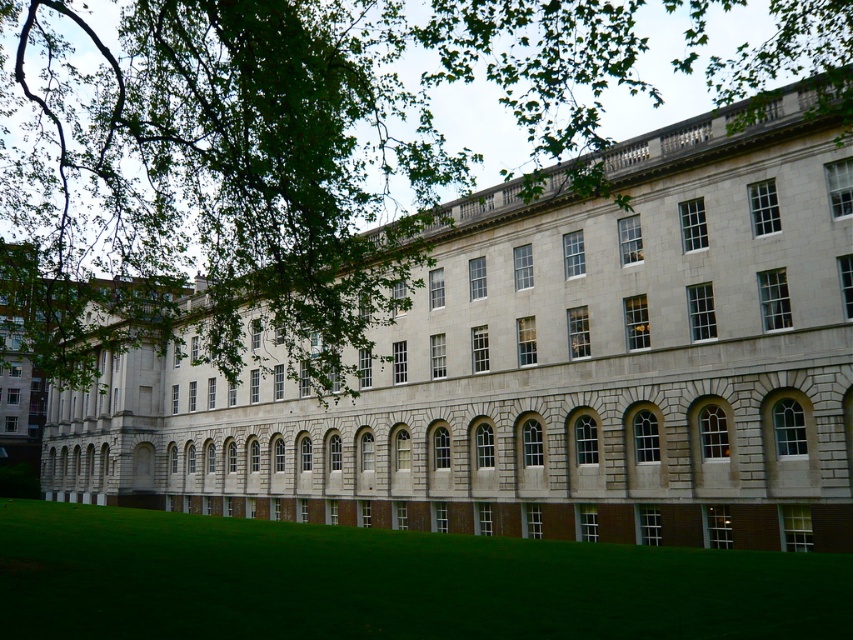
Question: Can you confirm if gray stone building at center is bigger than green grass at lower center?

Choices:
 (A) yes
 (B) no

Answer: (A)

Question: Can you confirm if gray stone building at center is positioned below green grass at lower center?

Choices:
 (A) yes
 (B) no

Answer: (B)

Question: Which point is closer to the camera taking this photo?

Choices:
 (A) (457, 596)
 (B) (579, 365)

Answer: (A)

Question: Can you confirm if gray stone building at center is smaller than green grass at lower center?

Choices:
 (A) no
 (B) yes

Answer: (A)